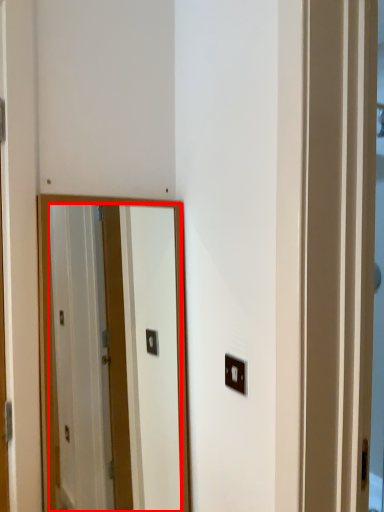
Question: From the image, what is the correct spatial relationship of mirror (annotated by the red box) in relation to light switch?

Choices:
 (A) right
 (B) left

Answer: (B)